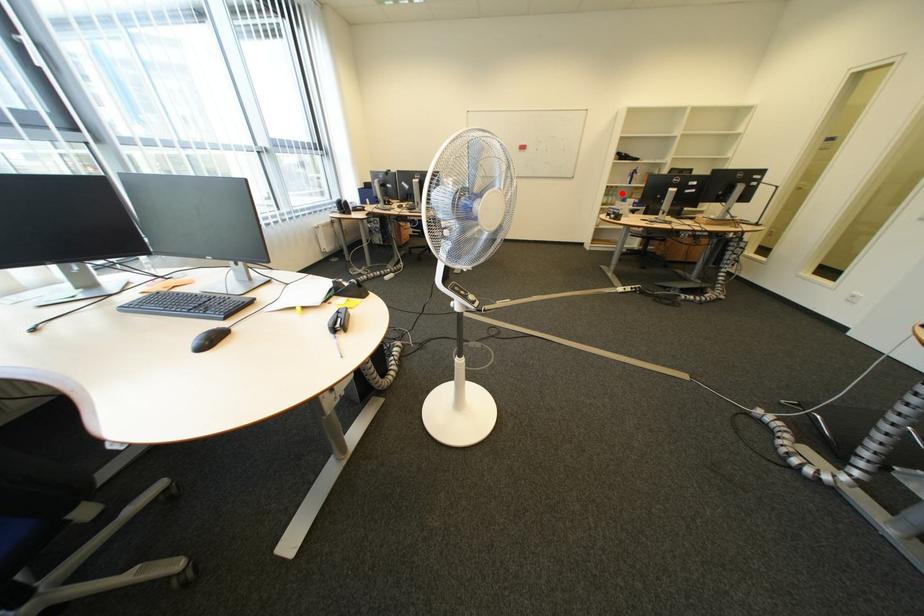
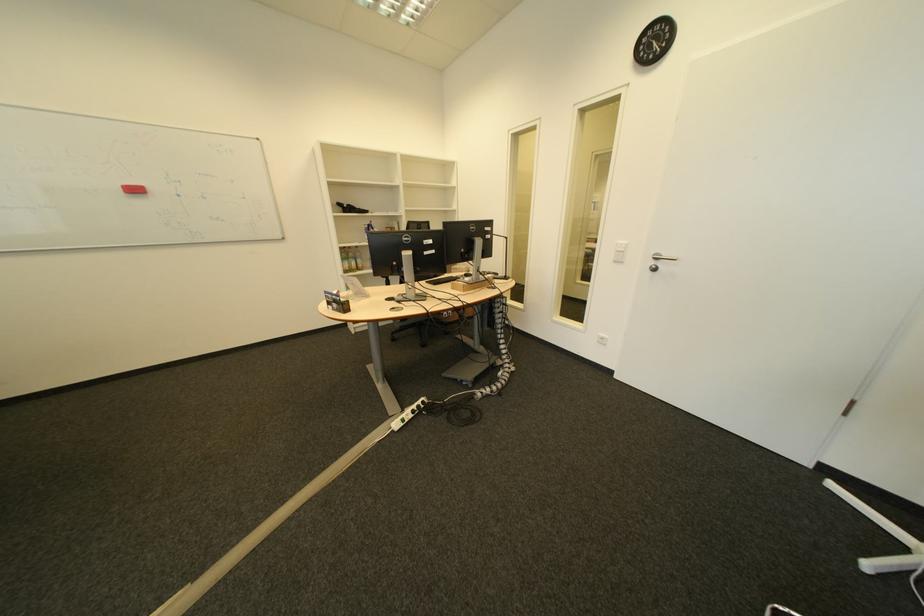
Where in the second image is the point corresponding to the highlighted location from the first image?

(360, 254)